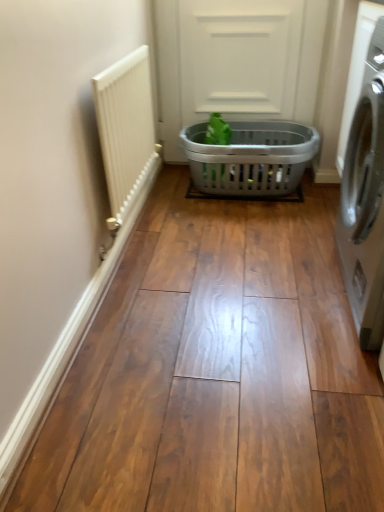
Question: Is satin silver washing machine at right wider or thinner than green matte plant at center?

Choices:
 (A) wide
 (B) thin

Answer: (A)

Question: From a real-world perspective, is satin silver washing machine at right physically located above or below green matte plant at center?

Choices:
 (A) below
 (B) above

Answer: (B)

Question: Which is nearer to the green matte plant at center?

Choices:
 (A) gray plastic laundry basket at center
 (B) satin silver washing machine at right
 (C) white textured radiator at left
 (D) gray plastic laundry basket at center

Answer: (A)

Question: Estimate the real-world distances between objects in this image. Which object is farther from the gray plastic laundry basket at center?

Choices:
 (A) satin silver washing machine at right
 (B) white textured radiator at left
 (C) gray plastic laundry basket at center
 (D) green matte plant at center

Answer: (A)